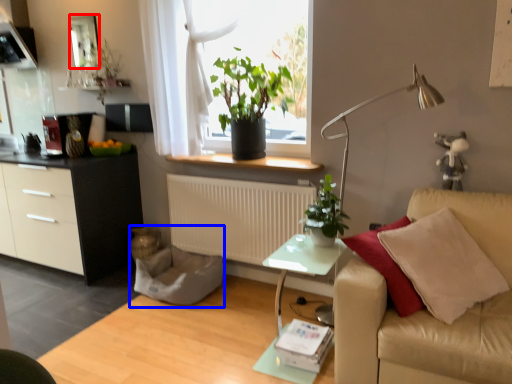
Question: Which object appears closest to the camera in this image, mirror (highlighted by a red box) or swivel chair (highlighted by a blue box)?

Choices:
 (A) mirror
 (B) swivel chair

Answer: (B)